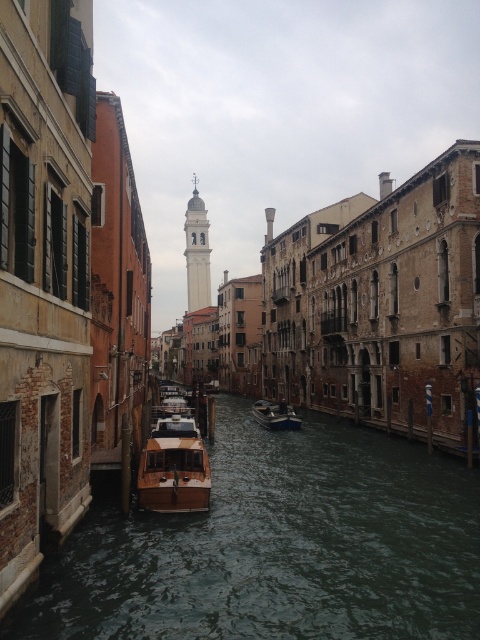
Question: Where is wooden boat at center located in relation to white marble bell tower at center in the image?

Choices:
 (A) above
 (B) below

Answer: (B)

Question: Estimate the real-world distances between objects in this image. Which object is farther from the wooden polished boat at center?

Choices:
 (A) greenish water at center
 (B) wooden boat at center

Answer: (B)

Question: Does wooden boat at center have a greater width compared to white marble bell tower at center?

Choices:
 (A) no
 (B) yes

Answer: (A)

Question: Can you confirm if greenish water at center is wider than white marble bell tower at center?

Choices:
 (A) no
 (B) yes

Answer: (B)

Question: Which of these objects is positioned farthest from the greenish water at center?

Choices:
 (A) wooden polished boat at center
 (B) white marble bell tower at center
 (C) wooden boat at center

Answer: (B)

Question: Among these points, which one is nearest to the camera?

Choices:
 (A) (279, 588)
 (B) (176, 440)

Answer: (A)